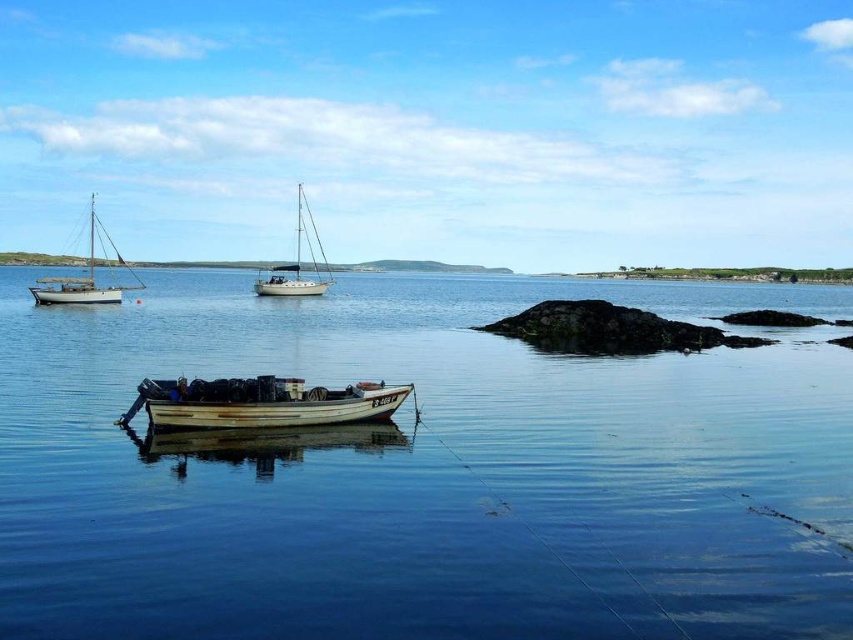
Question: Where is rusty metal boat at center located in relation to white matte sailboat at left in the image?

Choices:
 (A) left
 (B) right

Answer: (B)

Question: Is rusty metal boat at center above white matte sailboat at left?

Choices:
 (A) yes
 (B) no

Answer: (B)

Question: Which point is closer to the camera?

Choices:
 (A) (41, 298)
 (B) (368, 401)
 (C) (303, 214)

Answer: (B)

Question: Which point is farther from the camera taking this photo?

Choices:
 (A) (709, 349)
 (B) (86, 285)
 (C) (318, 244)
 (D) (165, 380)

Answer: (C)

Question: Among these points, which one is nearest to the camera?

Choices:
 (A) (296, 230)
 (B) (294, 385)

Answer: (B)

Question: Can you confirm if clear water at center is positioned below white matte sailboat at left?

Choices:
 (A) no
 (B) yes

Answer: (B)